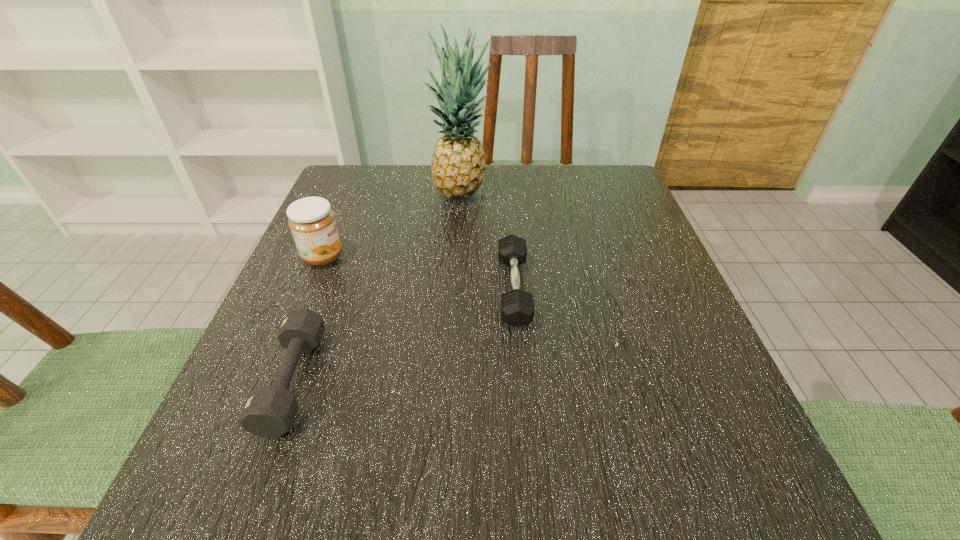
Identify the location of the farthest object. Image resolution: width=960 pixels, height=540 pixels. (458, 162).

This screenshot has width=960, height=540. Identify the location of the tallest object. (458, 162).

This screenshot has width=960, height=540. I want to click on the second tallest object, so click(x=312, y=222).

Image resolution: width=960 pixels, height=540 pixels. I want to click on the nearest object, so click(x=270, y=411).

Where is `the left dumbbell`? the left dumbbell is located at coordinates (270, 411).

At what (x,y) coordinates should I click in order to perform the action: click on the rightmost object. Please return your answer as a coordinate pair (x, y). Looking at the image, I should click on (517, 306).

Where is `the farther dumbbell`? The width and height of the screenshot is (960, 540). the farther dumbbell is located at coordinates (517, 306).

At what (x,y) coordinates should I click in order to perform the action: click on free space located 0.210m on the front of the pineapple. Please return your answer as a coordinate pair (x, y). The image size is (960, 540). Looking at the image, I should click on click(x=457, y=269).

Locate an element on the screen. This screenshot has width=960, height=540. vacant space located on the front label of the second tallest object is located at coordinates (444, 257).

Where is `free space located on the right of the left dumbbell`? free space located on the right of the left dumbbell is located at coordinates (459, 380).